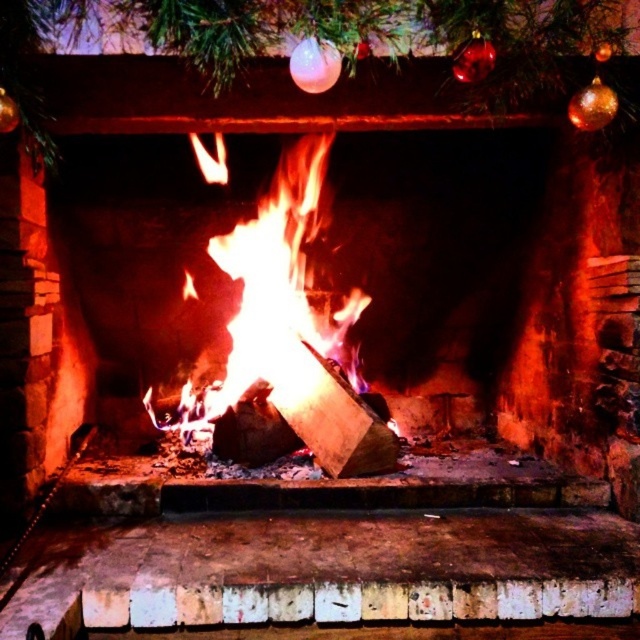
Consider the image. You are decorating a living room and want to ensure the shiny glass ornaments at upper center are visible above the brick fireplace at center. Based on the scene description, will the ornaments be visible above the fireplace?

The brick fireplace at center is taller than shiny glass ornaments at upper center, so the ornaments will be visible above the fireplace since they are placed higher up and the fireplace does not obstruct them.

You are standing in front of the brick fireplace at center and want to place a decorative item on the mantelpiece above the flaming wood at center. Which direction should you move to reach the mantelpiece?

The brick fireplace at center is to the left of the flaming wood at center, so to reach the mantelpiece above the flaming wood at center, you should move to the right from the brick fireplace at center.

You are standing in the room and want to place a new decoration on the brick fireplace at center. Based on the coordinates provided, where exactly should you aim to place it?

The brick fireplace at center is located at point 0.383 on the x and 0.494 on the y axis, so you should aim for those coordinates to place the decoration.